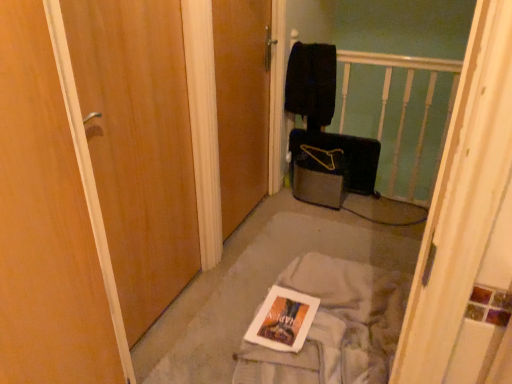
Image resolution: width=512 pixels, height=384 pixels. In order to click on wooden door at center, placed as the 2th door when sorted from left to right in this screenshot , I will do `click(242, 104)`.

The image size is (512, 384). What are the coordinates of `white glossy magazine at center` in the screenshot? It's located at (283, 320).

Describe the element at coordinates (283, 320) in the screenshot. I see `white glossy magazine at center` at that location.

Find the location of `wooden door at center, which is the 1th door from right to left`. wooden door at center, which is the 1th door from right to left is located at coordinates (242, 104).

From a real-world perspective, is white glossy magazine at center above or below wooden door at center, which is the 1th door from right to left?

From a real-world perspective, white glossy magazine at center is physically below wooden door at center, which is the 1th door from right to left.

Is white glossy magazine at center facing towards wooden door at center, placed as the 2th door when sorted from left to right?

No, white glossy magazine at center is not facing towards wooden door at center, placed as the 2th door when sorted from left to right.

Is white glossy magazine at center wider or thinner than wooden door at center, which is the 1th door from right to left?

Clearly, white glossy magazine at center has more width compared to wooden door at center, which is the 1th door from right to left.

Is white fabric at center surrounding wooden door at left, which is the first door in left-to-right order?

No, white fabric at center does not contain wooden door at left, which is the first door in left-to-right order.

Are white fabric at center and wooden door at left, the 2th door in the right-to-left sequence, far apart?

Actually, white fabric at center and wooden door at left, the 2th door in the right-to-left sequence, are a little close together.

Does white fabric at center have a greater width compared to wooden door at left, the 2th door in the right-to-left sequence?

Yes.

Could you tell me if white fabric at center is turned towards wooden door at left, which is the first door in left-to-right order?

Yes, white fabric at center faces towards wooden door at left, which is the first door in left-to-right order.

How much distance is there between wooden door at center, which is the 1th door from right to left, and wooden door at left, the 2th door in the right-to-left sequence?

21.55 inches.

Is wooden door at center, placed as the 2th door when sorted from left to right, in front of or behind wooden door at left, the 2th door in the right-to-left sequence, in the image?

Clearly, wooden door at center, placed as the 2th door when sorted from left to right, is behind wooden door at left, the 2th door in the right-to-left sequence.

Does wooden door at center, which is the 1th door from right to left, appear on the left side of wooden door at left, the 2th door in the right-to-left sequence?

No, wooden door at center, which is the 1th door from right to left, is not to the left of wooden door at left, the 2th door in the right-to-left sequence.

Looking at the image, does wooden door at center, placed as the 2th door when sorted from left to right, seem bigger or smaller compared to wooden door at left, the 2th door in the right-to-left sequence?

Considering their sizes, wooden door at center, placed as the 2th door when sorted from left to right, takes up more space than wooden door at left, the 2th door in the right-to-left sequence.

Where is `door in front of the white glossy magazine at center`? The image size is (512, 384). door in front of the white glossy magazine at center is located at coordinates (138, 146).

From the image's perspective, is white glossy magazine at center above wooden door at left, the 2th door in the right-to-left sequence?

No.

In the scene shown: Is white glossy magazine at center at the right side of wooden door at left, which is the first door in left-to-right order?

Indeed, white glossy magazine at center is positioned on the right side of wooden door at left, which is the first door in left-to-right order.

From a real-world perspective, is white glossy magazine at center physically located above or below wooden door at left, the 2th door in the right-to-left sequence?

From a real-world perspective, white glossy magazine at center is physically below wooden door at left, the 2th door in the right-to-left sequence.

Which object is positioned more to the right, white fabric at center or white wooden balustrade at upper center?

Positioned to the right is white wooden balustrade at upper center.

Is white fabric at center spatially inside white wooden balustrade at upper center, or outside of it?

white fabric at center is located beyond the bounds of white wooden balustrade at upper center.

Are white fabric at center and white wooden balustrade at upper center far apart?

Indeed, white fabric at center is not near white wooden balustrade at upper center.

Based on their sizes in the image, would you say white fabric at center is bigger or smaller than white wooden balustrade at upper center?

Clearly, white fabric at center is larger in size than white wooden balustrade at upper center.

From the picture: Which of these two, white fabric at center or black fabric suitcase at center, stands taller?

black fabric suitcase at center.

Would you consider white fabric at center to be distant from black fabric suitcase at center?

No.

What's the angular difference between white fabric at center and black fabric suitcase at center's facing directions?

There is a 90.5-degree angle between the facing directions of white fabric at center and black fabric suitcase at center.

From a real-world perspective, is white fabric at center located higher than black fabric suitcase at center?

No, from a real-world perspective, white fabric at center is not on top of black fabric suitcase at center.

Which object is positioned more to the left, white fabric at center or white glossy magazine at center?

white glossy magazine at center is more to the left.

Is white fabric at center outside of white glossy magazine at center?

Yes, white fabric at center is outside of white glossy magazine at center.

Looking at this image, between white fabric at center and white glossy magazine at center, which one has larger width?

white fabric at center.

Based on the photo, from a real-world perspective, does white fabric at center stand above white glossy magazine at center?

Actually, white fabric at center is physically below white glossy magazine at center in the real world.

Identify the location of magazine on the right side of wooden door at center, which is the 1th door from right to left. coord(283,320).

Where is `trim below the wooden door at left, which is the first door in left-to-right order (from the image's perspective)`? This screenshot has width=512, height=384. trim below the wooden door at left, which is the first door in left-to-right order (from the image's perspective) is located at coordinates pyautogui.click(x=335, y=326).

Based on the photo, considering their positions, is wooden door at left, the 2th door in the right-to-left sequence, positioned closer to wooden door at center, which is the 1th door from right to left, than white glossy magazine at center?

wooden door at left, the 2th door in the right-to-left sequence, is positioned closer to the anchor wooden door at center, which is the 1th door from right to left.

Estimate the real-world distances between objects in this image. Which object is closer to black fabric suitcase at center, white glossy magazine at center or white wooden balustrade at upper center?

white wooden balustrade at upper center is positioned closer to the anchor black fabric suitcase at center.

Considering their positions, is black fabric suitcase at center positioned further to white fabric at center than white fabric at center?

Among the two, black fabric suitcase at center is located further to white fabric at center.

Based on their spatial positions, is white fabric at center or white glossy magazine at center closer to black fabric suitcase at center?

white fabric at center is closer to black fabric suitcase at center.

When comparing their distances from wooden door at center, which is the 1th door from right to left, does white glossy magazine at center or black fabric suitcase at center seem further?

Among the two, white glossy magazine at center is located further to wooden door at center, which is the 1th door from right to left.

Looking at the image, which one is located further to white glossy magazine at center, white fabric at center or wooden door at left, which is the first door in left-to-right order?

wooden door at left, which is the first door in left-to-right order, is positioned further to the anchor white glossy magazine at center.

From the image, which object appears to be nearer to wooden door at left, which is the first door in left-to-right order, white glossy magazine at center or wooden door at center, placed as the 2th door when sorted from left to right?

Based on the image, wooden door at center, placed as the 2th door when sorted from left to right, appears to be nearer to wooden door at left, which is the first door in left-to-right order.

In the scene shown: Considering their positions, is white wooden balustrade at upper center positioned closer to black fabric suitcase at center than white fabric at center?

white wooden balustrade at upper center.

Locate an element on the screen. The height and width of the screenshot is (384, 512). door located between white fabric at center and black fabric suitcase at center in the depth direction is located at coordinates (242, 104).

At what (x,y) coordinates should I click in order to perform the action: click on concrete between wooden door at left, which is the first door in left-to-right order, and black fabric suitcase at center in the front-back direction. Please return your answer as a coordinate pair (x, y). The height and width of the screenshot is (384, 512). Looking at the image, I should click on (257, 285).

The width and height of the screenshot is (512, 384). In order to click on concrete between wooden door at center, placed as the 2th door when sorted from left to right, and white fabric at center, in the vertical direction in this screenshot , I will do `click(257, 285)`.

Find the location of a particular element. balustrade located between wooden door at left, which is the first door in left-to-right order, and black fabric suitcase at center in the depth direction is located at coordinates (400, 115).